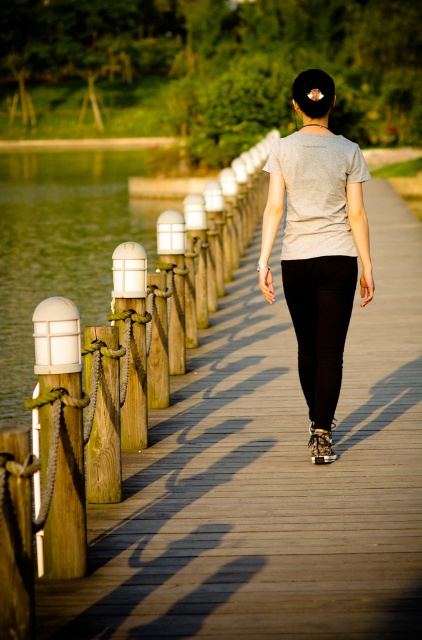
Question: Among these objects, which one is nearest to the camera?

Choices:
 (A) white painted wood post at left
 (B) wooden planks at center
 (C) gray cotton shirt at center

Answer: (B)

Question: Which point is farther to the camera?

Choices:
 (A) wooden planks at center
 (B) gray cotton shirt at center
 (C) white matte pole at left
 (D) white painted wood post at left

Answer: (B)

Question: Is wooden planks at center below white matte pole at left?

Choices:
 (A) no
 (B) yes

Answer: (A)

Question: Is wooden planks at center wider than white matte pole at left?

Choices:
 (A) yes
 (B) no

Answer: (A)

Question: Is the position of gray cotton shirt at center less distant than that of white matte pole at left?

Choices:
 (A) yes
 (B) no

Answer: (B)

Question: Which object appears closest to the camera in this image?

Choices:
 (A) gray cotton shirt at center
 (B) wooden planks at center
 (C) white matte pole at left
 (D) white painted wood post at left

Answer: (C)